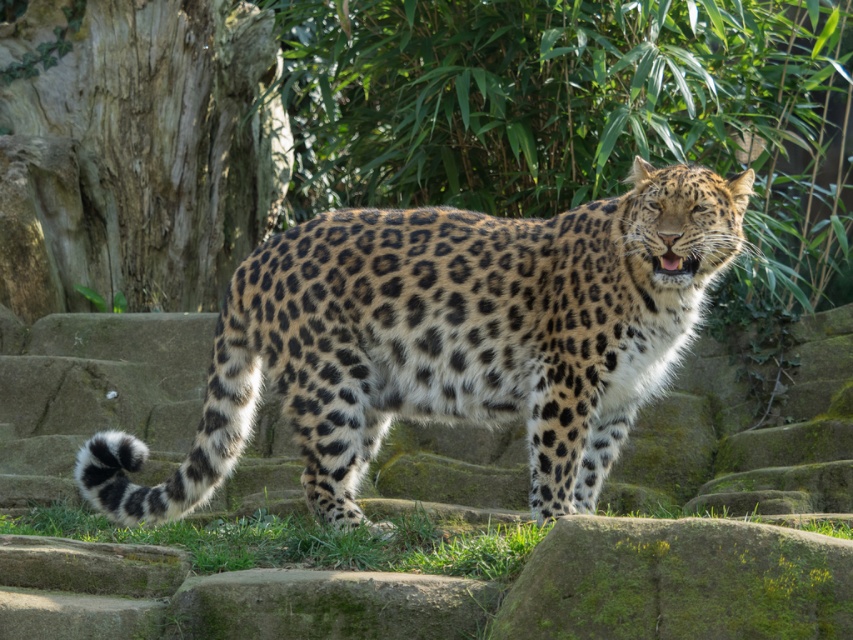
Is spotted fur leopard at center above green grass at lower center?

Indeed, spotted fur leopard at center is positioned over green grass at lower center.

Who is more distant from viewer, (347, 408) or (314, 531)?

The point (314, 531) is behind.

Does point (567, 396) come farther from viewer compared to point (376, 540)?

No, it is in front of (376, 540).

At what (x,y) coordinates should I click in order to perform the action: click on spotted fur leopard at center. Please return your answer as a coordinate pair (x, y). Looking at the image, I should click on (450, 339).